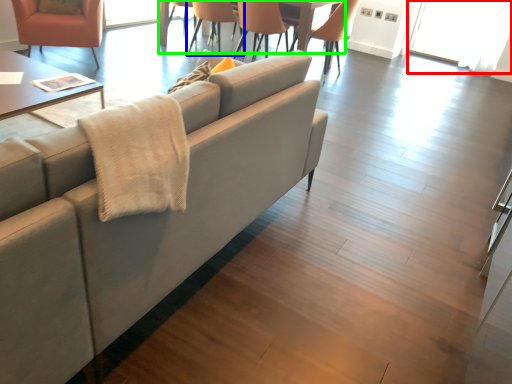
Question: Which object is the closest to the glass door (highlighted by a red box)? Choose among these: chair (highlighted by a blue box) or table (highlighted by a green box).

Choices:
 (A) chair
 (B) table

Answer: (B)